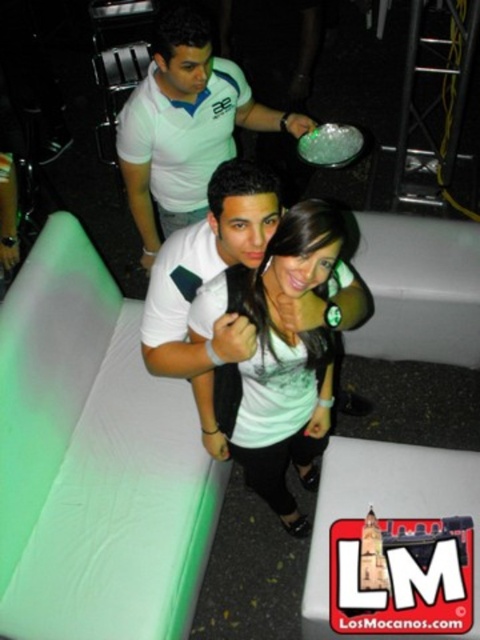
Question: In this image, where is white matte shirt at center located relative to white matte shirt at upper center?

Choices:
 (A) right
 (B) left

Answer: (A)

Question: Which point is farther from the camera taking this photo?

Choices:
 (A) (288, 396)
 (B) (140, 113)

Answer: (B)

Question: Which object is farther from the camera taking this photo?

Choices:
 (A) white matte shirt at center
 (B) white matte shirt at upper center

Answer: (B)

Question: Can you confirm if white matte shirt at center is wider than white matte shirt at upper center?

Choices:
 (A) yes
 (B) no

Answer: (B)

Question: Is white matte shirt at center thinner than white matte shirt at upper center?

Choices:
 (A) yes
 (B) no

Answer: (A)